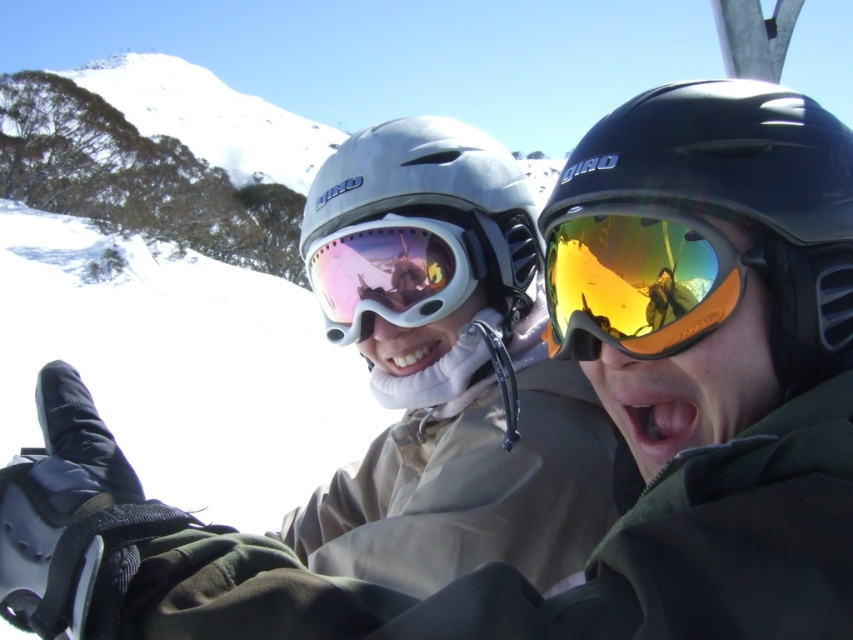
Is point (688, 257) positioned behind point (589, 209)?

That is False.

This screenshot has width=853, height=640. Identify the location of black matte helmet at right. (701, 259).

At what (x,y) coordinates should I click in order to perform the action: click on black matte helmet at right. Please return your answer as a coordinate pair (x, y). The width and height of the screenshot is (853, 640). Looking at the image, I should click on (701, 259).

Which of these two, matte gray helmet at center or pink reflective lens goggles at center, stands shorter?

With less height is pink reflective lens goggles at center.

From the picture: Is matte gray helmet at center above pink reflective lens goggles at center?

Indeed, matte gray helmet at center is positioned over pink reflective lens goggles at center.

Is point (496, 305) farther from viewer compared to point (412, 266)?

Yes, point (496, 305) is behind point (412, 266).

This screenshot has height=640, width=853. In order to click on matte gray helmet at center in this screenshot , I will do `click(418, 225)`.

How much distance is there between matte gray helmet at center and gold reflective lens at center?

The distance of matte gray helmet at center from gold reflective lens at center is 1.16 meters.

Does point (460, 209) come farther from viewer compared to point (654, 236)?

Yes, point (460, 209) is behind point (654, 236).

Between point (509, 262) and point (567, 328), which one is positioned behind?

The point (509, 262) is behind.

Locate an element on the screen. Image resolution: width=853 pixels, height=640 pixels. matte gray helmet at center is located at coordinates (418, 225).